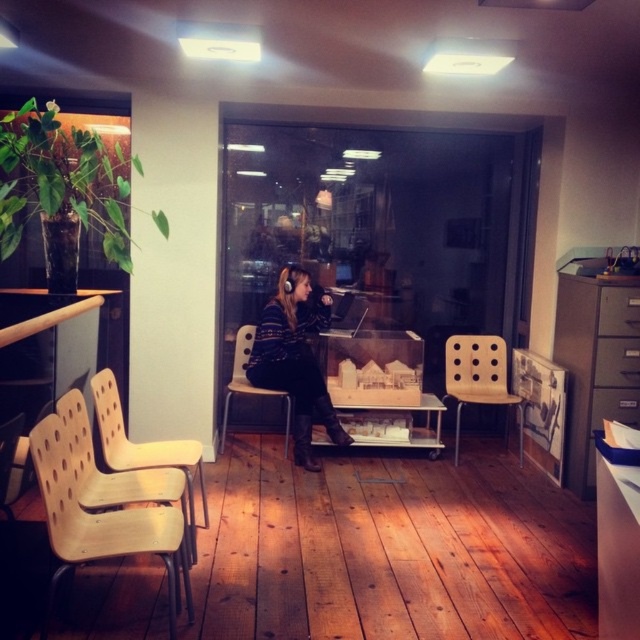
Question: Is light brown perforated chair at left further to the viewer compared to wooden perforated chair at center?

Choices:
 (A) no
 (B) yes

Answer: (A)

Question: Which object is positioned farthest from the matte black laptop at center?

Choices:
 (A) light brown wood chair at left
 (B) light brown perforated chair at left
 (C) light brown plastic chair at left
 (D) striped sweater at center

Answer: (C)

Question: Which is nearer to the light brown wood chair at left?

Choices:
 (A) light brown plastic chair at left
 (B) wooden perforated chair at center

Answer: (A)

Question: Which point appears farthest from the camera in this image?

Choices:
 (A) (225, 413)
 (B) (484, 396)
 (C) (112, 417)
 (D) (310, 385)

Answer: (A)

Question: Is light brown wooden chair at right in front of light brown plastic chair at left?

Choices:
 (A) yes
 (B) no

Answer: (B)

Question: Does light brown wooden chair at right appear on the left side of wooden perforated chair at center?

Choices:
 (A) yes
 (B) no

Answer: (B)